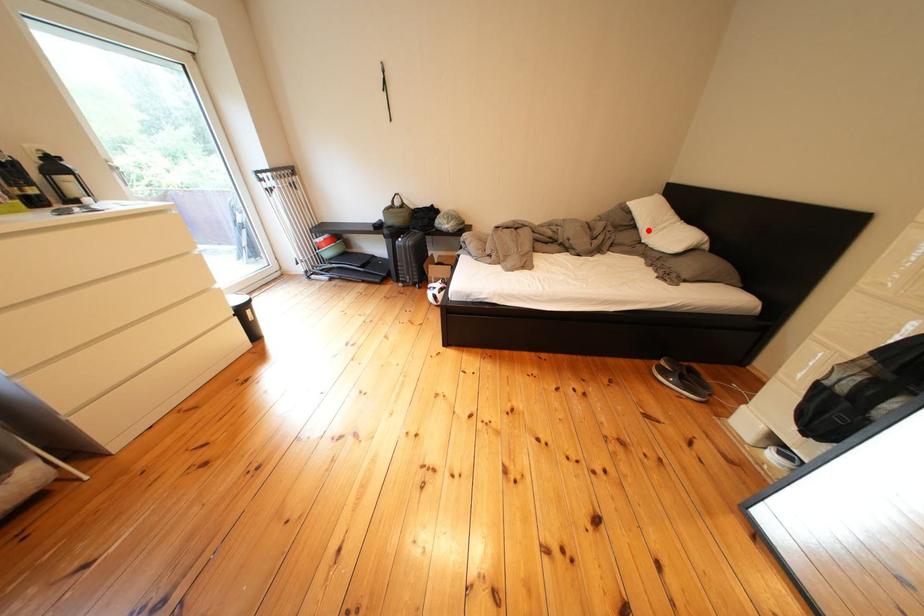
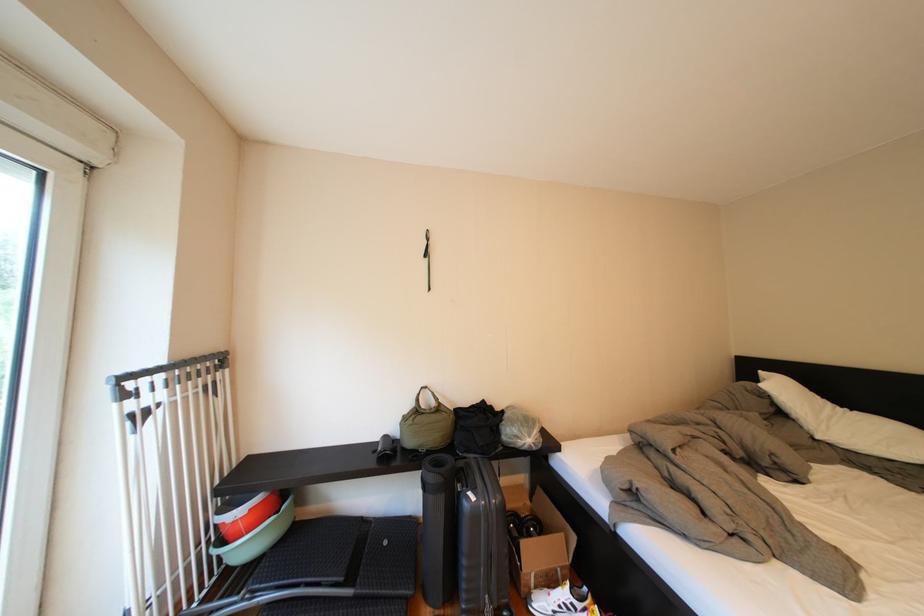
Question: I am providing you with two images of the same scene from different viewpoints. A red point is marked on the first image. Can you still see the location of the red point in image 2?

Choices:
 (A) Yes
 (B) No

Answer: (A)